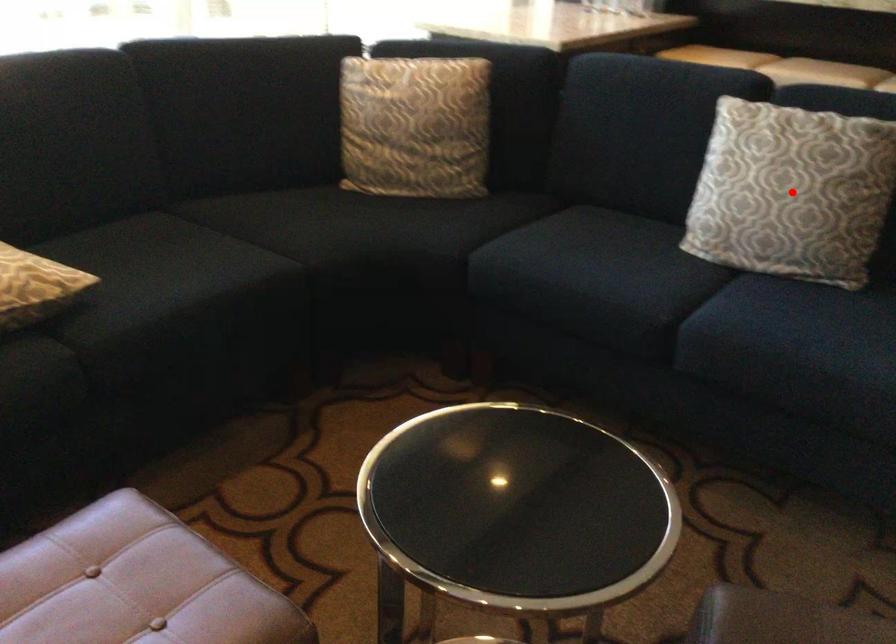
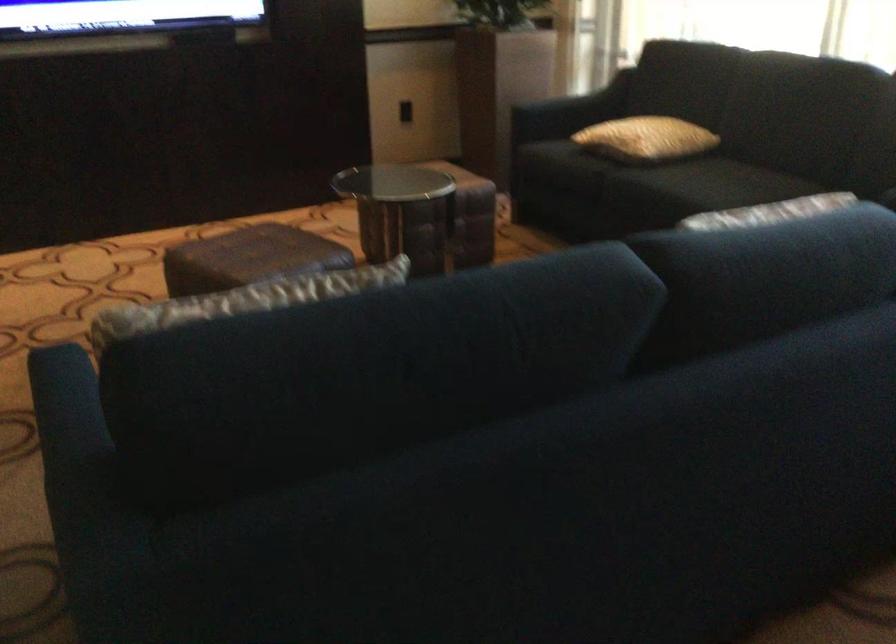
Question: I am providing you with two images of the same scene from different viewpoints. A red point is marked on the first image. At the location where the point appears in image 1, is it still visible in image 2?

Choices:
 (A) Yes
 (B) No

Answer: (B)